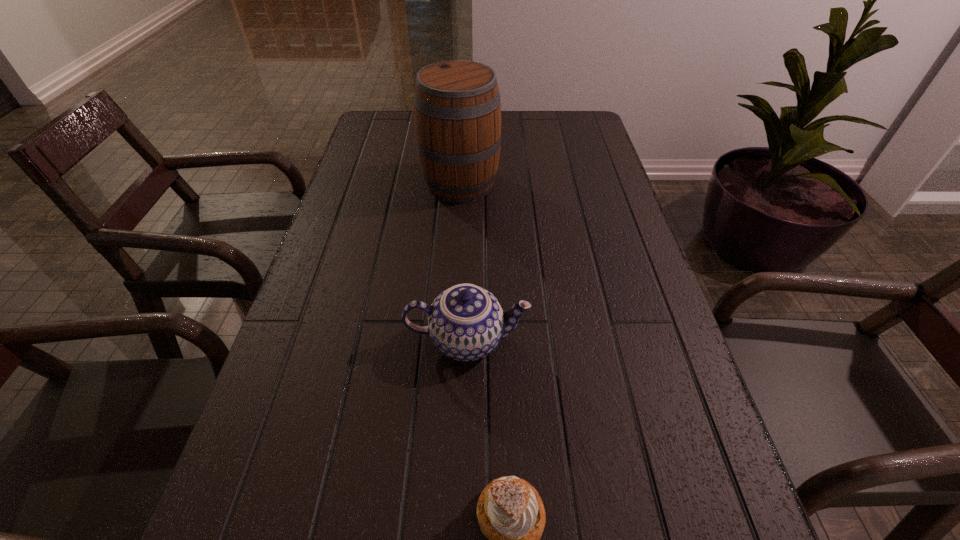
At what (x,y) coordinates should I click in order to perform the action: click on the farthest object. Please return your answer as a coordinate pair (x, y). Looking at the image, I should click on (457, 109).

At what (x,y) coordinates should I click in order to perform the action: click on cider. Please return your answer as a coordinate pair (x, y). The image size is (960, 540). Looking at the image, I should click on (457, 109).

Locate an element on the screen. the second shortest object is located at coordinates (466, 322).

At what (x,y) coordinates should I click in order to perform the action: click on the second farthest object. Please return your answer as a coordinate pair (x, y). The height and width of the screenshot is (540, 960). Looking at the image, I should click on (x=466, y=322).

You are a GUI agent. You are given a task and a screenshot of the screen. Output one action in this format:
    pyautogui.click(x=<x>, y=<y>)
    Task: Click on the vacant space located on the front of the tallest object
    This screenshot has height=540, width=960.
    Given the screenshot: What is the action you would take?
    458,221

In order to click on vacant space located at the spout of the second farthest object in this screenshot , I will do `click(612, 340)`.

The image size is (960, 540). Identify the location of blank space at the far edge of the desktop. (540, 146).

I want to click on vacant space at the left edge, so click(x=300, y=322).

Where is `vacant space at the right edge of the desktop`? vacant space at the right edge of the desktop is located at coordinates (581, 303).

Locate an element on the screen. This screenshot has height=540, width=960. free space at the far left corner of the desktop is located at coordinates (394, 123).